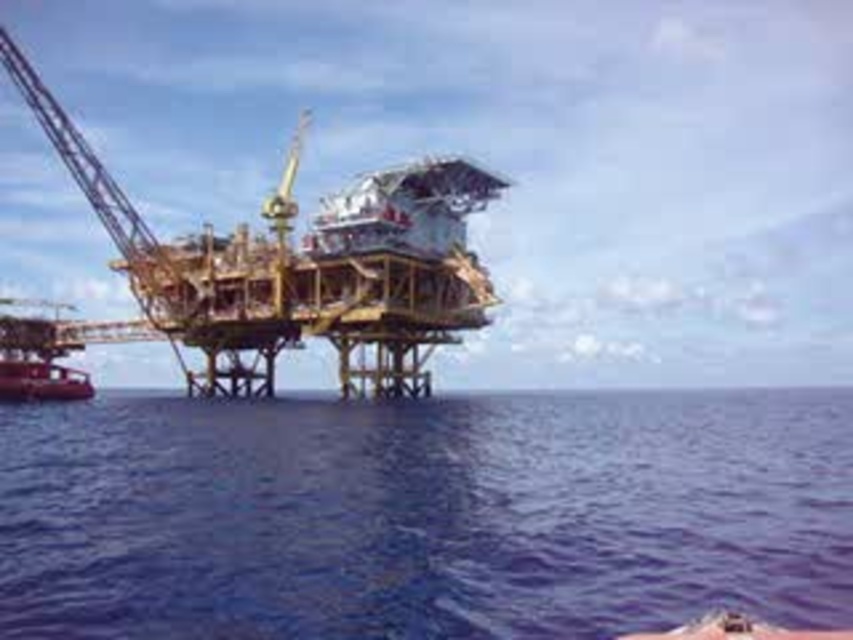
Question: Is blue water at center below metallic red boat at lower left?

Choices:
 (A) yes
 (B) no

Answer: (A)

Question: Which of the following is the closest to the observer?

Choices:
 (A) metallic red boat at lower left
 (B) blue water at center

Answer: (B)

Question: Is blue water at center closer to camera compared to metallic red boat at lower left?

Choices:
 (A) no
 (B) yes

Answer: (B)

Question: Which point is closer to the camera?

Choices:
 (A) blue water at center
 (B) metallic red boat at lower left

Answer: (A)

Question: Which point is farther to the camera?

Choices:
 (A) metallic red boat at lower left
 (B) blue water at center

Answer: (A)

Question: Can you confirm if blue water at center is positioned to the right of metallic red boat at lower left?

Choices:
 (A) no
 (B) yes

Answer: (B)